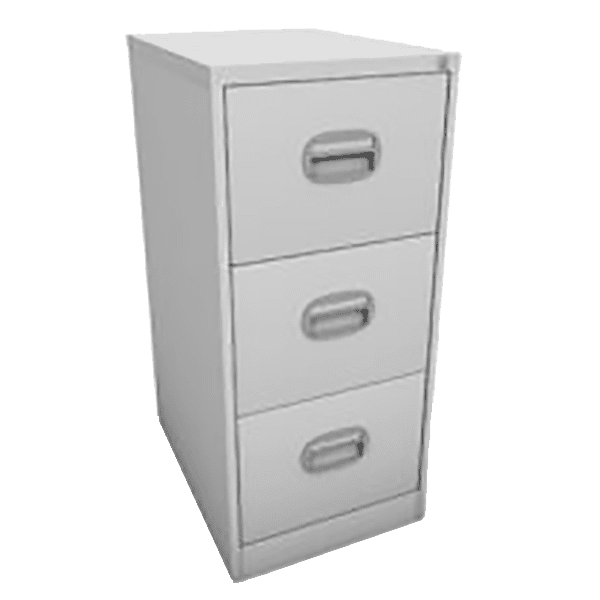
At what (x,y) coordinates should I click in order to perform the action: click on top drawer. Please return your answer as a coordinate pair (x, y). Looking at the image, I should click on (x=236, y=97).